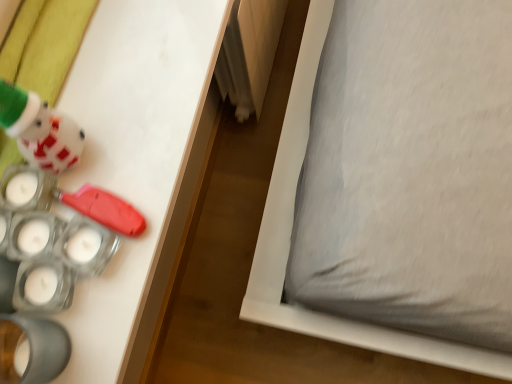
Question: From the image's perspective, is matte white plush at upper left, placed as the second toy when sorted from bottom to top, above translucent plastic candle holder at lower left, which is the second toy from top to bottom?

Choices:
 (A) yes
 (B) no

Answer: (A)

Question: Can you confirm if matte white plush at upper left, which is the first toy in top-to-bottom order, is taller than translucent plastic candle holder at lower left, which is counted as the first toy, starting from the bottom?

Choices:
 (A) no
 (B) yes

Answer: (B)

Question: From the image's perspective, would you say matte white plush at upper left, which is the first toy in top-to-bottom order, is shown under translucent plastic candle holder at lower left, which is counted as the first toy, starting from the bottom?

Choices:
 (A) no
 (B) yes

Answer: (A)

Question: Is the position of matte white plush at upper left, placed as the second toy when sorted from bottom to top, more distant than that of translucent plastic candle holder at lower left, which is counted as the first toy, starting from the bottom?

Choices:
 (A) yes
 (B) no

Answer: (B)

Question: Is matte white plush at upper left, which is the first toy in top-to-bottom order, at the left side of translucent plastic candle holder at lower left, which is the second toy from top to bottom?

Choices:
 (A) no
 (B) yes

Answer: (B)

Question: Considering their positions, is gray fabric pillow at lower right located in front of or behind translucent plastic candle holder at lower left, which is the second toy from top to bottom?

Choices:
 (A) front
 (B) behind

Answer: (B)

Question: Is gray fabric pillow at lower right bigger or smaller than translucent plastic candle holder at lower left, which is counted as the first toy, starting from the bottom?

Choices:
 (A) big
 (B) small

Answer: (A)

Question: Is gray fabric pillow at lower right situated inside translucent plastic candle holder at lower left, which is the second toy from top to bottom, or outside?

Choices:
 (A) outside
 (B) inside

Answer: (A)

Question: From the image's perspective, is gray fabric pillow at lower right positioned above or below translucent plastic candle holder at lower left, which is counted as the first toy, starting from the bottom?

Choices:
 (A) above
 (B) below

Answer: (A)

Question: Is point (54, 375) closer or farther from the camera than point (6, 120)?

Choices:
 (A) closer
 (B) farther

Answer: (B)

Question: In the image, is translucent plastic candle holder at lower left, which is counted as the first toy, starting from the bottom, positioned in front of or behind matte white plush at upper left, placed as the second toy when sorted from bottom to top?

Choices:
 (A) front
 (B) behind

Answer: (B)

Question: From a real-world perspective, relative to matte white plush at upper left, which is the first toy in top-to-bottom order, is translucent plastic candle holder at lower left, which is the second toy from top to bottom, vertically above or below?

Choices:
 (A) below
 (B) above

Answer: (A)

Question: Considering the positions of translucent plastic candle holder at lower left, which is counted as the first toy, starting from the bottom, and matte white plush at upper left, placed as the second toy when sorted from bottom to top, in the image, is translucent plastic candle holder at lower left, which is counted as the first toy, starting from the bottom, wider or thinner than matte white plush at upper left, placed as the second toy when sorted from bottom to top,?

Choices:
 (A) wide
 (B) thin

Answer: (B)

Question: Relative to translucent plastic candle holder at lower left, which is the second toy from top to bottom, is matte white plush at upper left, which is the first toy in top-to-bottom order, in front or behind?

Choices:
 (A) behind
 (B) front

Answer: (B)

Question: From a real-world perspective, relative to translucent plastic candle holder at lower left, which is counted as the first toy, starting from the bottom, is matte white plush at upper left, placed as the second toy when sorted from bottom to top, vertically above or below?

Choices:
 (A) below
 (B) above

Answer: (B)